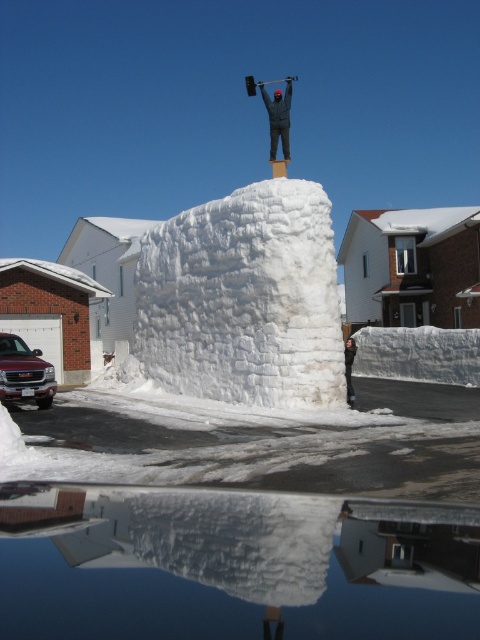
Question: Is dark gray fabric at center positioned behind dark gray fabric jacket at center?

Choices:
 (A) no
 (B) yes

Answer: (B)

Question: Which of the following is the closest to the observer?

Choices:
 (A) dark gray fabric at center
 (B) dark gray fabric jacket at center

Answer: (B)

Question: Which of the following is the closest to the observer?

Choices:
 (A) (289, 83)
 (B) (352, 356)

Answer: (B)

Question: In this image, where is dark gray fabric at center located relative to dark gray fabric jacket at center?

Choices:
 (A) right
 (B) left

Answer: (A)

Question: Does dark gray fabric at center have a lesser width compared to dark gray fabric jacket at center?

Choices:
 (A) yes
 (B) no

Answer: (B)